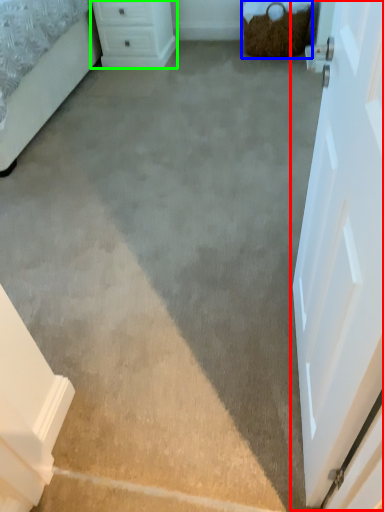
Question: Which object is positioned closest to door (highlighted by a red box)? Select from basket (highlighted by a blue box) and chest of drawers (highlighted by a green box).

Choices:
 (A) basket
 (B) chest of drawers

Answer: (A)